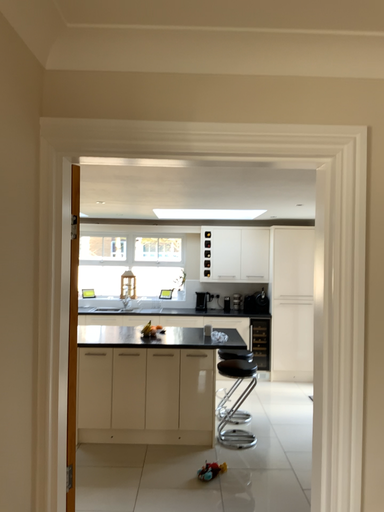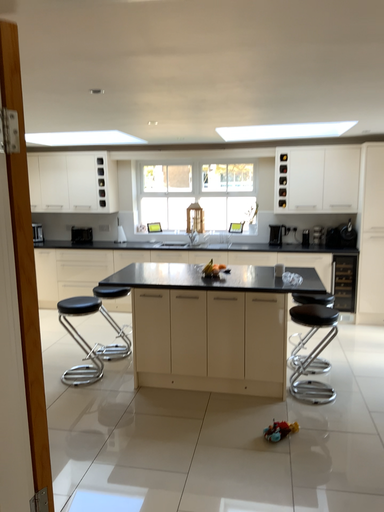
Question: Which way did the camera rotate in the video?

Choices:
 (A) rotated left
 (B) rotated right

Answer: (A)